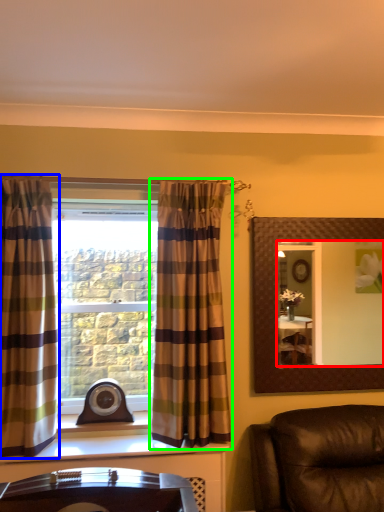
Question: Estimate the real-world distances between objects in this image. Which object is farther from mirror (highlighted by a red box), curtain (highlighted by a blue box) or curtain (highlighted by a green box)?

Choices:
 (A) curtain
 (B) curtain

Answer: (A)